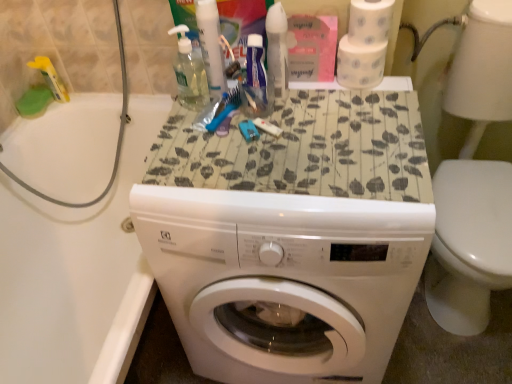
At what (x,y) coordinates should I click in order to perform the action: click on free spot in front of translucent plastic spray bottle at upper center, which is the second cleaning product from left to right. Please return your answer as a coordinate pair (x, y). This screenshot has height=384, width=512. Looking at the image, I should click on click(x=291, y=139).